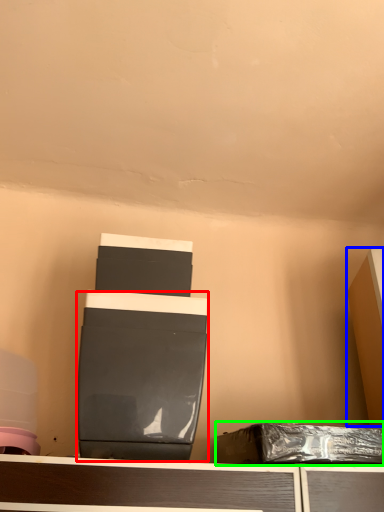
Question: Which is nearer to the wide (highlighted by a red box)? furniture (highlighted by a blue box) or waste (highlighted by a green box).

Choices:
 (A) furniture
 (B) waste

Answer: (B)